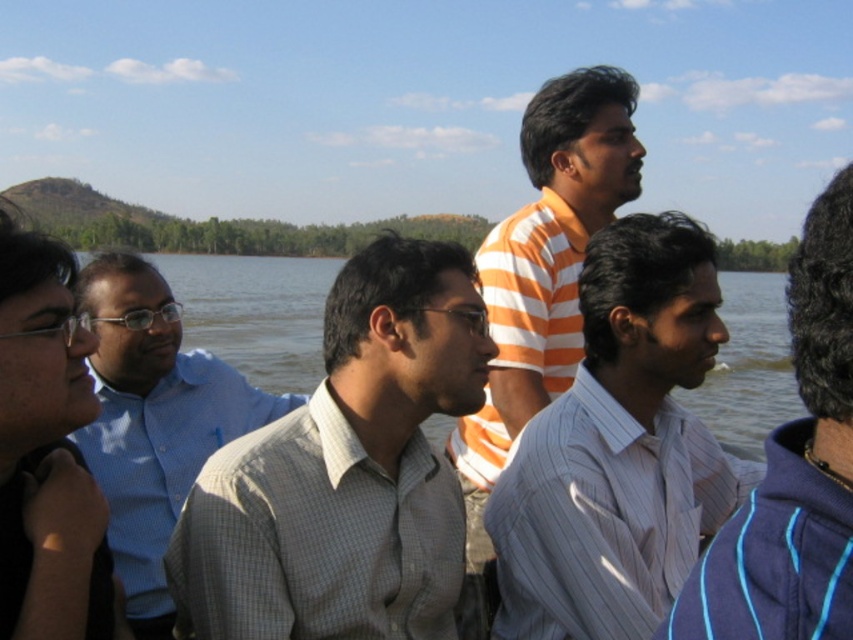
Looking at this image, you are standing at the position of point (171,332) and want to walk towards the position of point (494,273). Based on the scene description, will you be moving towards the background or the foreground of the image?

Point (494,273) is behind point (171,332), so moving towards it would mean moving towards the background of the image.

You are a photographer trying to capture a group photo of the orange striped shirt at center and the blue checkered shirt at left. The camera you are using has a maximum focus range of 8 feet. Can you fit both subjects within the camera frame without moving either of them?

The orange striped shirt at center and blue checkered shirt at left are 8.36 feet apart, which exceeds the camera maximum focus range of 8 feet. Therefore, the photographer cannot fit both subjects within the camera frame without moving either of them.

You are a photographer trying to capture a photo of the striped cotton shirt at right and the blue water at center. Which object is shorter in height?

The striped cotton shirt at right has a lesser height compared to the blue water at center, so the striped cotton shirt at right is shorter in height.